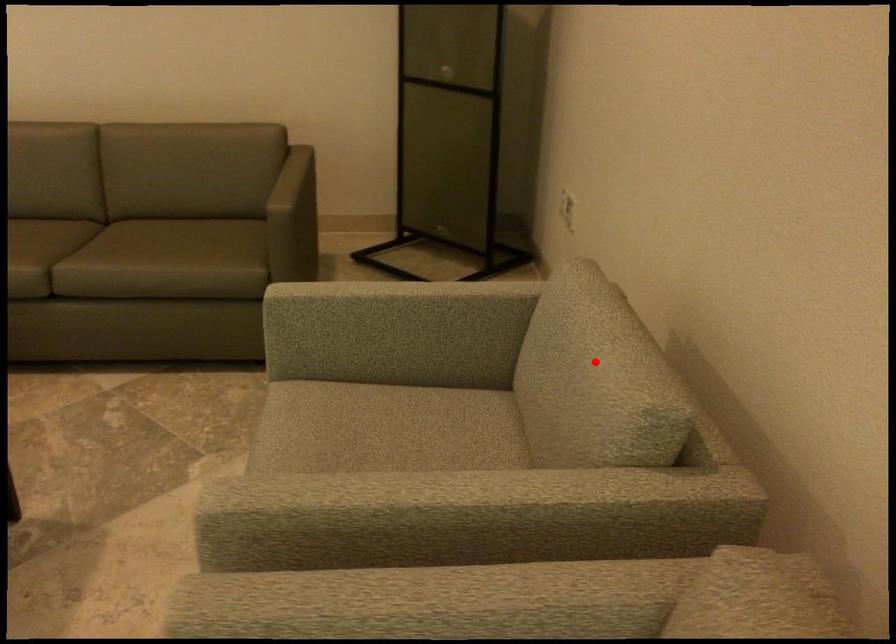
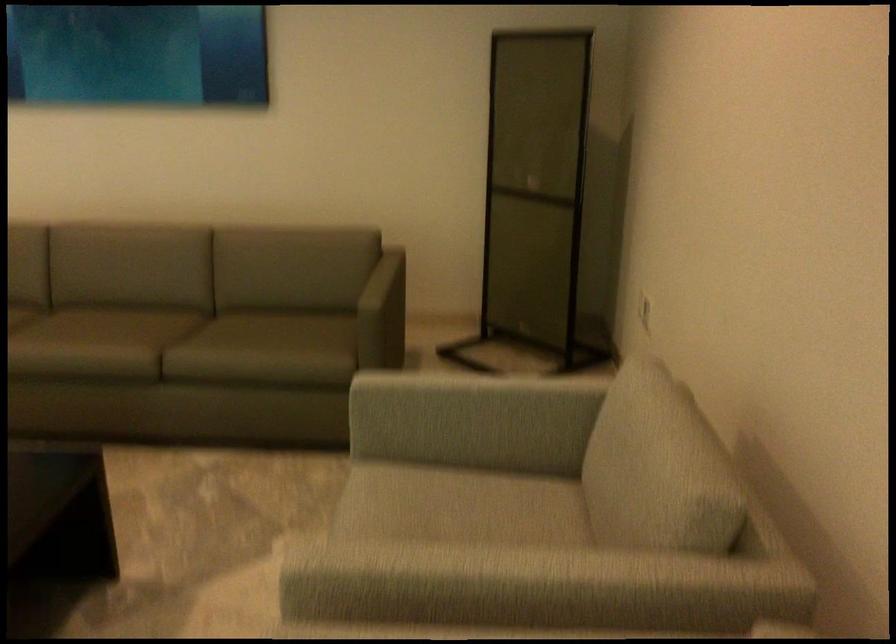
Locate, in the second image, the point that corresponds to the highlighted location in the first image.

(653, 451)